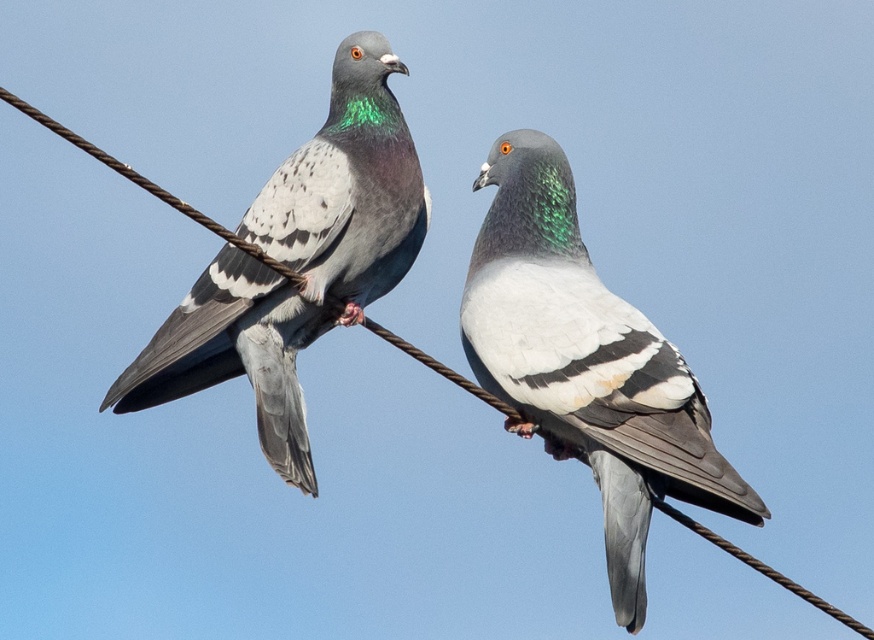
Can you confirm if matte gray pigeon at center is wider than matte gray pigeon at left?

Yes, matte gray pigeon at center is wider than matte gray pigeon at left.

Is point (517, 360) closer to viewer compared to point (302, 336)?

Yes.

In order to click on matte gray pigeon at center in this screenshot , I will do `click(585, 364)`.